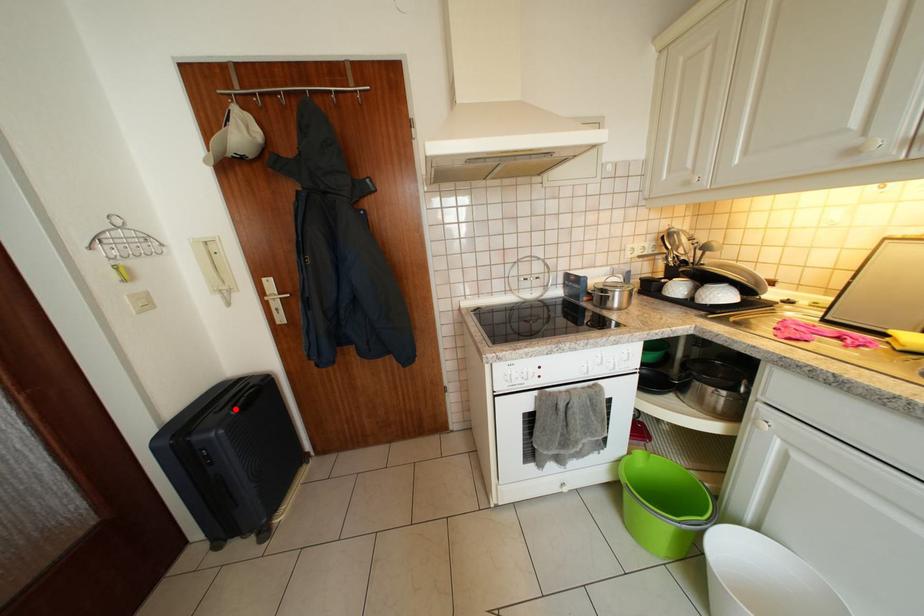
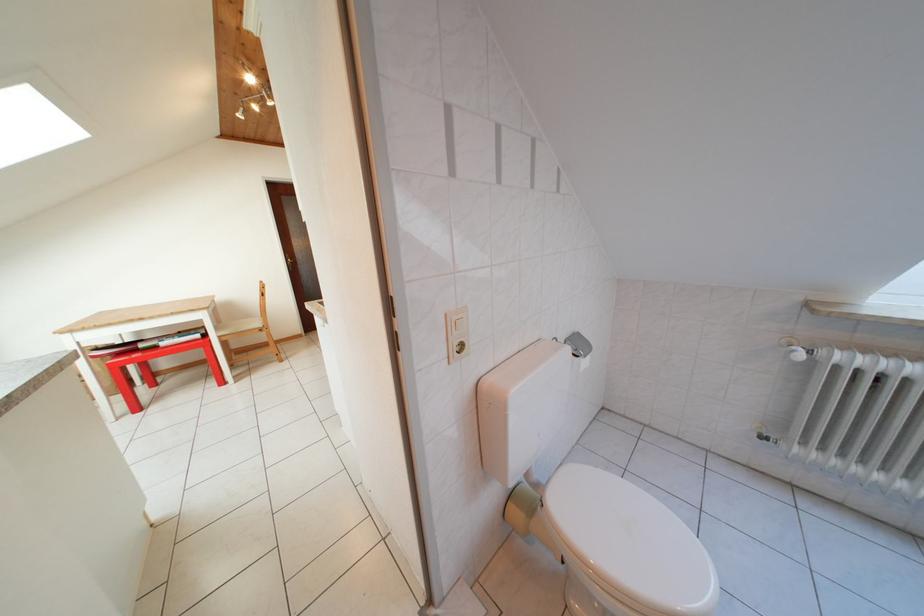
Question: I am providing you with two images of the same scene from different viewpoints. A red point is marked on the first image. Can you still see the location of the red point in image 2?

Choices:
 (A) Yes
 (B) No

Answer: (B)